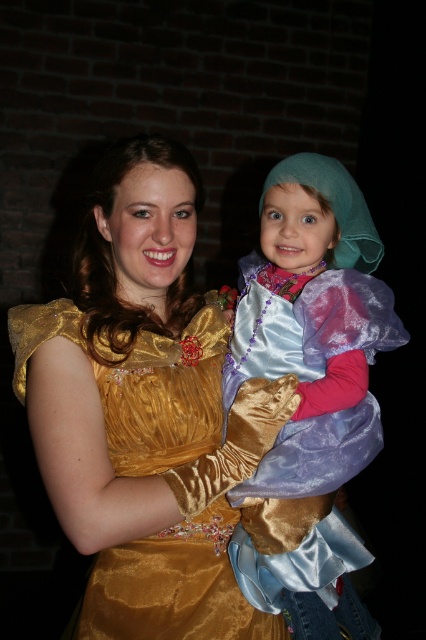
Is gold satin dress at center closer to the viewer compared to shiny satin dress at center?

Yes, gold satin dress at center is closer to the viewer.

Which is below, gold satin dress at center or shiny satin dress at center?

Positioned lower is shiny satin dress at center.

From the picture: Measure the distance between gold satin dress at center and camera.

1.02 meters

Where is `gold satin dress at center`? Image resolution: width=426 pixels, height=640 pixels. gold satin dress at center is located at coordinates (141, 410).